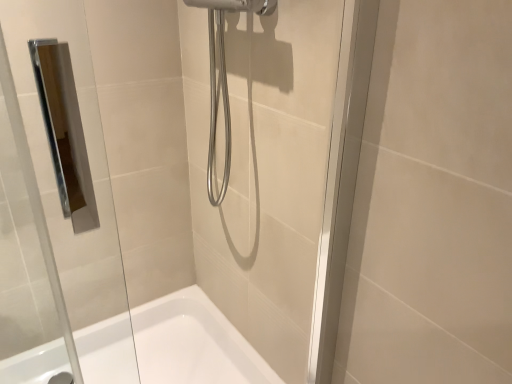
Question: In terms of size, does white glossy bathtub at lower center appear bigger or smaller than transparent glass door at center?

Choices:
 (A) small
 (B) big

Answer: (B)

Question: Considering their positions, is white glossy bathtub at lower center located in front of or behind transparent glass door at center?

Choices:
 (A) behind
 (B) front

Answer: (A)

Question: Is white glossy bathtub at lower center spatially inside transparent glass door at center, or outside of it?

Choices:
 (A) inside
 (B) outside

Answer: (B)

Question: In terms of size, does transparent glass door at center appear bigger or smaller than white glossy bathtub at lower center?

Choices:
 (A) small
 (B) big

Answer: (A)

Question: In terms of width, does transparent glass door at center look wider or thinner when compared to white glossy bathtub at lower center?

Choices:
 (A) thin
 (B) wide

Answer: (A)

Question: Is point (176, 254) positioned closer to the camera than point (19, 370)?

Choices:
 (A) farther
 (B) closer

Answer: (A)

Question: From a real-world perspective, is transparent glass door at center positioned above or below white glossy bathtub at lower center?

Choices:
 (A) below
 (B) above

Answer: (B)